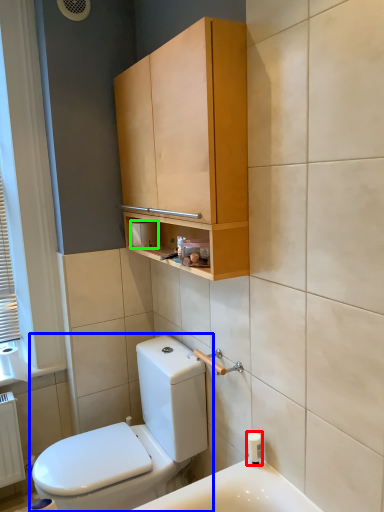
Question: Which object is positioned farthest from toiletry (highlighted by a red box)? Select from toilet (highlighted by a blue box) and toilet paper (highlighted by a green box).

Choices:
 (A) toilet
 (B) toilet paper

Answer: (B)